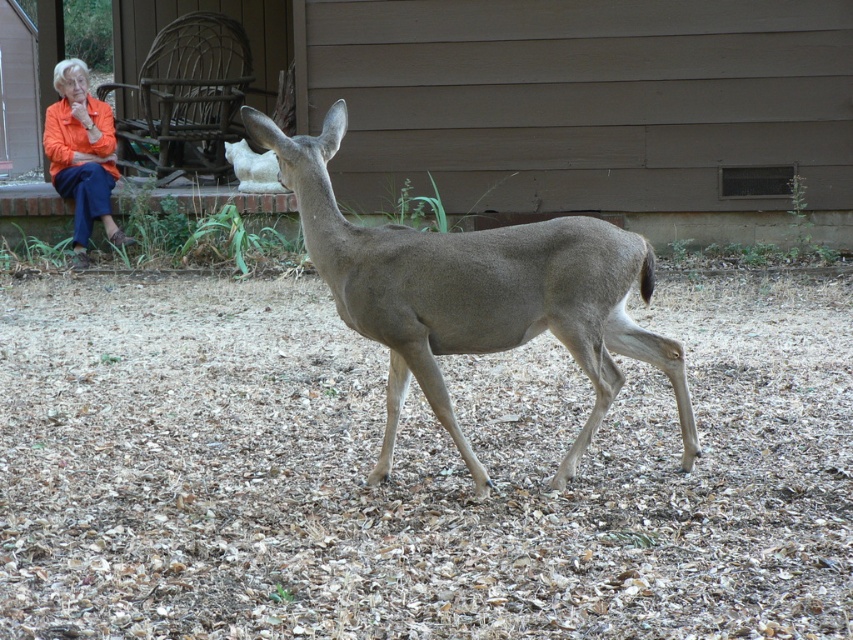
Between gray matte deer at center and orange fabric jacket at upper left, which one is positioned lower?

gray matte deer at center is lower down.

Who is more distant from viewer, (x=581, y=221) or (x=86, y=212)?

The point (x=86, y=212) is more distant.

You are a GUI agent. You are given a task and a screenshot of the screen. Output one action in this format:
    pyautogui.click(x=<x>, y=<y>)
    Task: Click on the gray matte deer at center
    The image size is (853, 640).
    Given the screenshot: What is the action you would take?
    pyautogui.click(x=474, y=292)

Can you confirm if orange fabric jacket at upper left is thinner than white fur at center?

No, orange fabric jacket at upper left is not thinner than white fur at center.

This screenshot has height=640, width=853. What do you see at coordinates (80, 156) in the screenshot?
I see `orange fabric jacket at upper left` at bounding box center [80, 156].

The width and height of the screenshot is (853, 640). Find the location of `orange fabric jacket at upper left`. orange fabric jacket at upper left is located at coordinates (80, 156).

Does gray matte deer at center have a smaller size compared to white fur at center?

No.

Is point (561, 342) positioned before point (247, 172)?

Yes, point (561, 342) is in front of point (247, 172).

Where is `gray matte deer at center`? The width and height of the screenshot is (853, 640). gray matte deer at center is located at coordinates (474, 292).